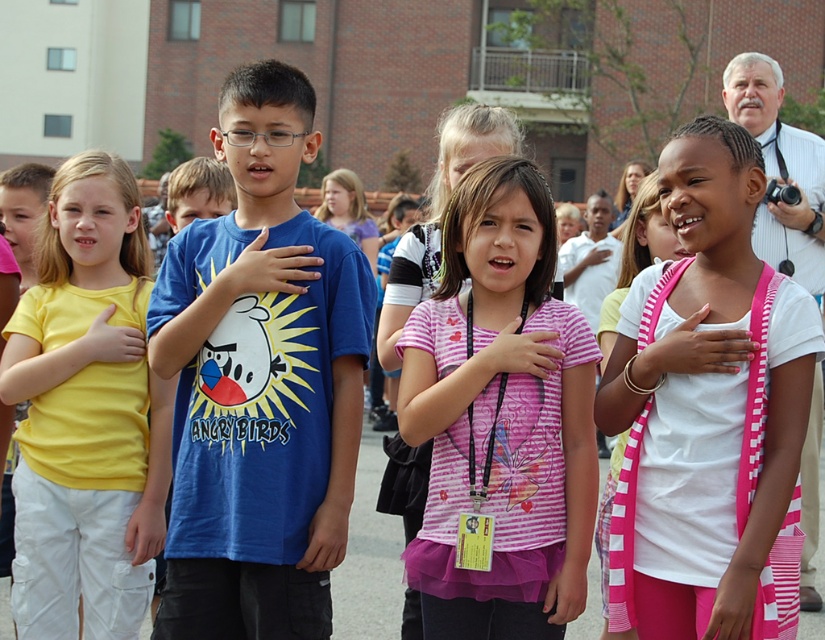
Based on the photo, you are standing in the scene and want to move from the point at coordinates point [182,358] to the point at coordinates point [102,387]. Which direction should you move to get closer to the camera?

To move from point [182,358] to point [102,387], you should move downward because point [182,358] is closer to the camera than point [102,387].